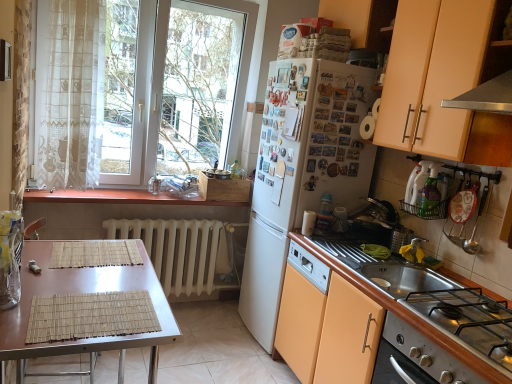
What is the approximate height of sheer white curtain at left?

sheer white curtain at left is 3.79 feet tall.

Image resolution: width=512 pixels, height=384 pixels. In order to click on wooden at left in this screenshot , I will do pyautogui.click(x=119, y=197).

You are a GUI agent. You are given a task and a screenshot of the screen. Output one action in this format:
    pyautogui.click(x=<x>, y=<y>)
    Task: Click on the white matte refrigerator at center
    The width and height of the screenshot is (512, 384).
    Given the screenshot: What is the action you would take?
    pyautogui.click(x=301, y=170)

Locate an element on the screen. The height and width of the screenshot is (384, 512). white glossy cup at upper center, which is the first appliance from back to front is located at coordinates (308, 223).

Does white matte refrigerator at center have a lesser height compared to matte peach cabinet at upper right, acting as the 2th cabinetry starting from the bottom?

In fact, white matte refrigerator at center may be taller than matte peach cabinet at upper right, acting as the 2th cabinetry starting from the bottom.

Is white matte refrigerator at center facing away from matte peach cabinet at upper right, the first cabinetry from the top?

white matte refrigerator at center is not turned away from matte peach cabinet at upper right, the first cabinetry from the top.

Is white matte refrigerator at center not inside matte peach cabinet at upper right, the first cabinetry from the top?

white matte refrigerator at center lies outside matte peach cabinet at upper right, the first cabinetry from the top,'s area.

Which point is more distant from viewer, [306,179] or [492,134]?

The point [306,179] is farther from the camera.

From the image's perspective, does white metallic radiator at center appear higher than white glass window at upper left?

Actually, white metallic radiator at center appears below white glass window at upper left in the image.

Is white glass window at upper left at the back of white metallic radiator at center?

No, white metallic radiator at center is not facing away from white glass window at upper left.

You are a GUI agent. You are given a task and a screenshot of the screen. Output one action in this format:
    pyautogui.click(x=<x>, y=<y>)
    Task: Click on the window above the white metallic radiator at center (from the image's perspective)
    This screenshot has width=512, height=384.
    Given the screenshot: What is the action you would take?
    pyautogui.click(x=137, y=88)

Looking at their sizes, would you say white metallic radiator at center is wider or thinner than white glass window at upper left?

In the image, white metallic radiator at center appears to be more narrow than white glass window at upper left.

Is sheer white curtain at left to the right of white glass window at upper left from the viewer's perspective?

In fact, sheer white curtain at left is to the left of white glass window at upper left.

Can white glass window at upper left be found inside sheer white curtain at left?

No, white glass window at upper left is not a part of sheer white curtain at left.

How many degrees apart are the facing directions of sheer white curtain at left and white glass window at upper left?

The angle between the facing direction of sheer white curtain at left and the facing direction of white glass window at upper left is 0.754 degrees.

Can you confirm if sheer white curtain at left is wider than white glass window at upper left?

In fact, sheer white curtain at left might be narrower than white glass window at upper left.

The image size is (512, 384). In order to click on window that appears above the sheer white curtain at left (from a real-world perspective) in this screenshot , I will do `click(137, 88)`.

Which point is more forward, (186, 29) or (99, 29)?

The point (99, 29) is in front.

Looking at this image, considering the sizes of objects white glass window at upper left and sheer white curtain at left in the image provided, who is bigger, white glass window at upper left or sheer white curtain at left?

white glass window at upper left.

Considering the points (279, 73) and (130, 140), which point is in front, point (279, 73) or point (130, 140)?

Positioned in front is point (279, 73).

From the image's perspective, which one is positioned higher, white matte refrigerator at center or white glass window at upper left?

white glass window at upper left is shown above in the image.

Is white matte refrigerator at center far away from white glass window at upper left?

No, white matte refrigerator at center is in close proximity to white glass window at upper left.

From the picture: From a real-world perspective, is white matte refrigerator at center below white glass window at upper left?

Yes.

Is matte peach cabinet at upper right, the first cabinetry from the top, facing away from orange matte cabinet at lower right, which is the second cabinetry in top-to-bottom order?

matte peach cabinet at upper right, the first cabinetry from the top, does not have its back to orange matte cabinet at lower right, which is the second cabinetry in top-to-bottom order.

Can you confirm if matte peach cabinet at upper right, the first cabinetry from the top, is thinner than orange matte cabinet at lower right, which is the second cabinetry in top-to-bottom order?

Correct, the width of matte peach cabinet at upper right, the first cabinetry from the top, is less than that of orange matte cabinet at lower right, which is the second cabinetry in top-to-bottom order.

How many degrees apart are the facing directions of matte peach cabinet at upper right, acting as the 2th cabinetry starting from the bottom, and orange matte cabinet at lower right, which is the second cabinetry in top-to-bottom order?

The angular difference between matte peach cabinet at upper right, acting as the 2th cabinetry starting from the bottom, and orange matte cabinet at lower right, which is the second cabinetry in top-to-bottom order, is 0.000102 degrees.

Is matte peach cabinet at upper right, the first cabinetry from the top, touching orange matte cabinet at lower right, arranged as the first cabinetry when ordered from the bottom?

There is a gap between matte peach cabinet at upper right, the first cabinetry from the top, and orange matte cabinet at lower right, arranged as the first cabinetry when ordered from the bottom.

Is point (93, 109) closer or farther from the camera than point (436, 132)?

Point (93, 109) appears to be farther away from the viewer than point (436, 132).

Considering the relative sizes of white glass window at upper left and matte peach cabinet at upper right, the first cabinetry from the top, in the image provided, is white glass window at upper left smaller than matte peach cabinet at upper right, the first cabinetry from the top,?

No, white glass window at upper left is not smaller than matte peach cabinet at upper right, the first cabinetry from the top.

Where is `window below the matte peach cabinet at upper right, the first cabinetry from the top (from a real-world perspective)`? The width and height of the screenshot is (512, 384). window below the matte peach cabinet at upper right, the first cabinetry from the top (from a real-world perspective) is located at coordinates (137, 88).

Does white glass window at upper left have a greater height compared to matte peach cabinet at upper right, the first cabinetry from the top?

Indeed, white glass window at upper left has a greater height compared to matte peach cabinet at upper right, the first cabinetry from the top.

From the white matte refrigerator at center, count 2nd cabinetry to the right and point to it. Please provide its 2D coordinates.

[(444, 81)]

In order to click on window in front of the white metallic radiator at center in this screenshot , I will do `click(137, 88)`.

Based on their spatial positions, is clear glass jar at left or white plastic dish rack at right, which is counted as the first appliance, starting from the right, further from sheer white curtain at left?

white plastic dish rack at right, which is counted as the first appliance, starting from the right.

From the image, which object appears to be nearer to white glass window at upper left, white glossy cup at upper center, placed as the first appliance when sorted from bottom to top, or stainless steel gas stove at lower right?

Based on the image, white glossy cup at upper center, placed as the first appliance when sorted from bottom to top, appears to be nearer to white glass window at upper left.

From the image, which object appears to be farther from orange matte cabinet at lower right, arranged as the first cabinetry when ordered from the bottom, sheer white curtain at left or stainless steel gas stove at lower right?

Based on the image, sheer white curtain at left appears to be further to orange matte cabinet at lower right, arranged as the first cabinetry when ordered from the bottom.

Estimate the real-world distances between objects in this image. Which object is further from wooden at left, sheer white curtain at left or stainless steel gas stove at lower right?

Among the two, stainless steel gas stove at lower right is located further to wooden at left.

Based on their spatial positions, is clear glass jar at left or white matte refrigerator at center closer to wooden at left?

clear glass jar at left is closer to wooden at left.

Estimate the real-world distances between objects in this image. Which object is further from brown bamboo placemat at lower left, white glass window at upper left or stainless steel gas stove at lower right?

white glass window at upper left is further to brown bamboo placemat at lower left.

When comparing their distances from sheer white curtain at left, does white glossy cup at upper center, the second appliance in the right-to-left sequence, or clear glass jar at left seem closer?

Based on the image, clear glass jar at left appears to be nearer to sheer white curtain at left.

From the image, which object appears to be farther from sheer white curtain at left, white metallic radiator at center or white glossy cup at upper center, placed as the first appliance when sorted from bottom to top?

The object further to sheer white curtain at left is white glossy cup at upper center, placed as the first appliance when sorted from bottom to top.

Identify the location of glass jar situated between sheer white curtain at left and white matte refrigerator at center from left to right. The width and height of the screenshot is (512, 384). (10, 268).

At what (x,y) coordinates should I click in order to perform the action: click on refrigerator between brown bamboo placemat at lower left and wooden at left along the z-axis. Please return your answer as a coordinate pair (x, y). This screenshot has width=512, height=384. Looking at the image, I should click on (301, 170).

You are a GUI agent. You are given a task and a screenshot of the screen. Output one action in this format:
    pyautogui.click(x=<x>, y=<y>)
    Task: Click on the radiator between wooden at left and white matte refrigerator at center from left to right
    The width and height of the screenshot is (512, 384).
    Given the screenshot: What is the action you would take?
    pyautogui.click(x=176, y=250)

Where is `curtain between brown bamboo placemat at lower left and wooden at left from front to back`? This screenshot has width=512, height=384. curtain between brown bamboo placemat at lower left and wooden at left from front to back is located at coordinates (69, 92).